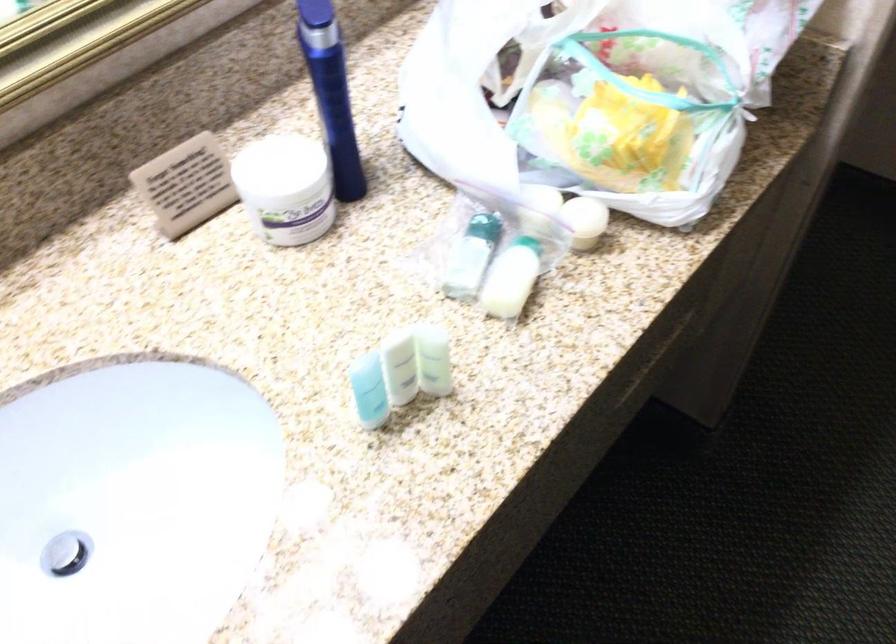
Find where to squeez the small white bottle. Please return your answer as a coordinate pair (x, y).

(433, 360)